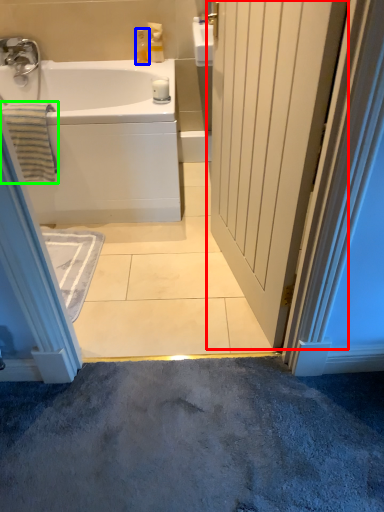
Question: Which object is the closest to the door (highlighted by a red box)? Choose among these: toiletry (highlighted by a blue box) or bath towel (highlighted by a green box).

Choices:
 (A) toiletry
 (B) bath towel

Answer: (B)